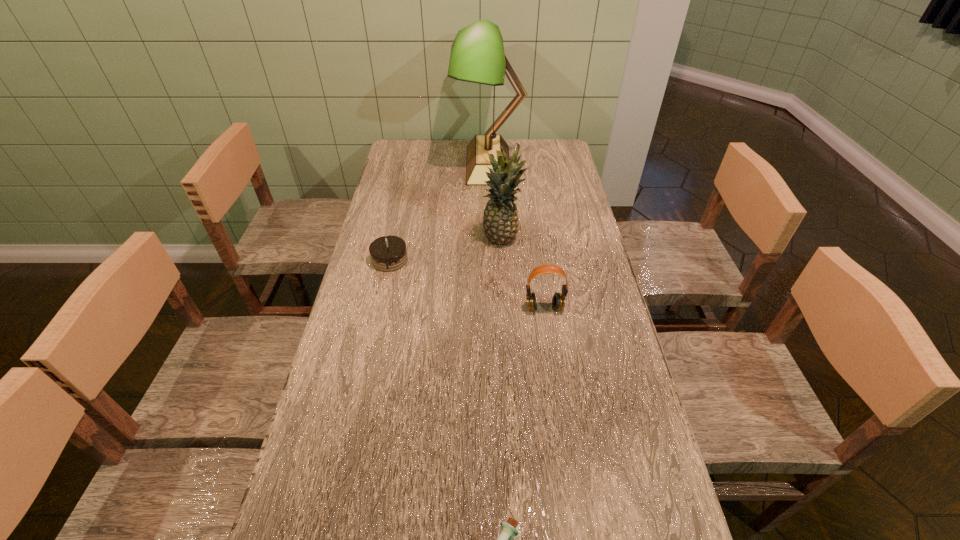
Where is `empty location between the chocolate cake and the fourth shortest object`? empty location between the chocolate cake and the fourth shortest object is located at coordinates (446, 249).

This screenshot has height=540, width=960. I want to click on blank region between the second tallest object and the chocolate cake, so click(446, 249).

You are a GUI agent. You are given a task and a screenshot of the screen. Output one action in this format:
    pyautogui.click(x=<x>, y=<y>)
    Task: Click on the empty space that is in between the pineapple and the leftmost object
    
    Given the screenshot: What is the action you would take?
    pyautogui.click(x=446, y=249)

The width and height of the screenshot is (960, 540). I want to click on free space between the tallest object and the headset, so click(x=516, y=236).

Select which object is the third closest to the leftmost object. Please provide its 2D coordinates. Your answer should be formatted as a tuple, i.e. [(x, y)], where the tuple contains the x and y coordinates of a point satisfying the conditions above.

[(477, 55)]

This screenshot has width=960, height=540. I want to click on object that is the third nearest to the pineapple, so click(x=477, y=55).

Where is `vacant position in the image that satisfies the following two spatial constraints: 1. on the metallic stand of the fourth shortest object; 2. on the right side of the tallest object`? This screenshot has width=960, height=540. vacant position in the image that satisfies the following two spatial constraints: 1. on the metallic stand of the fourth shortest object; 2. on the right side of the tallest object is located at coordinates (491, 239).

Where is `free spot that satisfies the following two spatial constraints: 1. on the metallic stand of the table lamp; 2. on the left side of the second tallest object`? This screenshot has height=540, width=960. free spot that satisfies the following two spatial constraints: 1. on the metallic stand of the table lamp; 2. on the left side of the second tallest object is located at coordinates (491, 239).